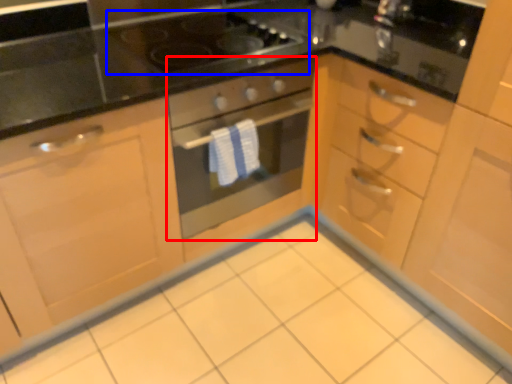
Question: Which object is further to the camera taking this photo, oven (highlighted by a red box) or gas stove (highlighted by a blue box)?

Choices:
 (A) oven
 (B) gas stove

Answer: (B)